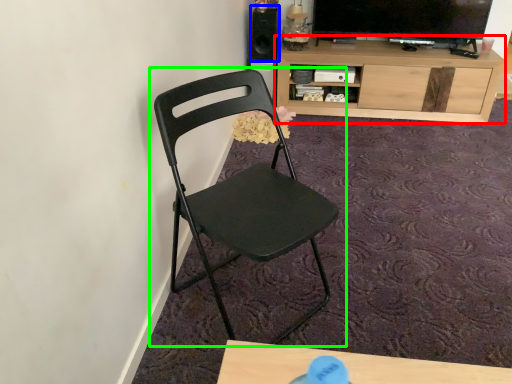
Question: Which object is positioned farthest from cabinetry (highlighted by a red box)? Select from speaker (highlighted by a blue box) and chair (highlighted by a green box).

Choices:
 (A) speaker
 (B) chair

Answer: (B)